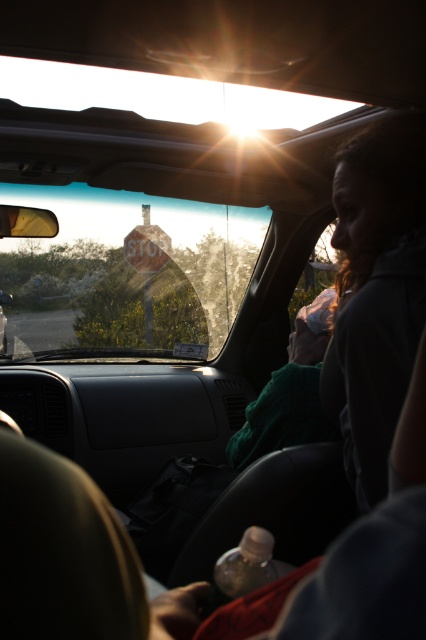
Is point (230, 241) positioned after point (146, 268)?

No.

The image size is (426, 640). In order to click on transparent glass stop sign at center in this screenshot , I will do `click(126, 269)`.